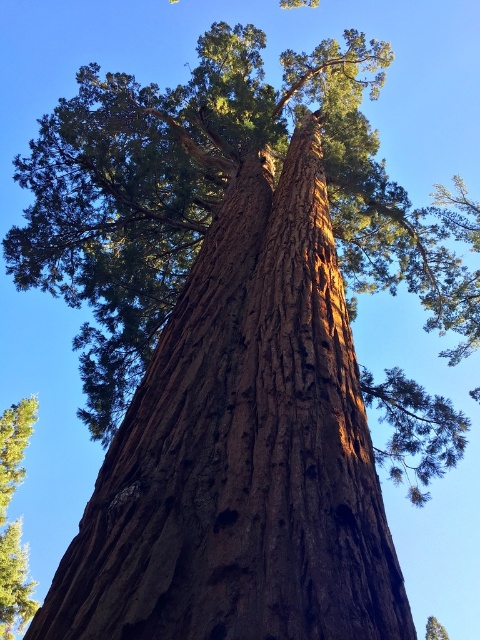
You are standing at the base of the tree and looking up. Which object is closer to you between the smooth brown bark at center and the green textured tree at upper center?

The smooth brown bark at center is closer to you because it is smaller in size compared to the green textured tree at upper center, indicating it is nearer in the visual perspective.

You are standing at the base of the tree and want to touch both the smooth brown bark at center and the green textured tree at upper center. Which part can you reach without climbing?

The smooth brown bark at center is closer to the viewer than the green textured tree at upper center, so you can reach the smooth brown bark at center without climbing, but the green textured tree at upper center is higher up and would require climbing to reach.